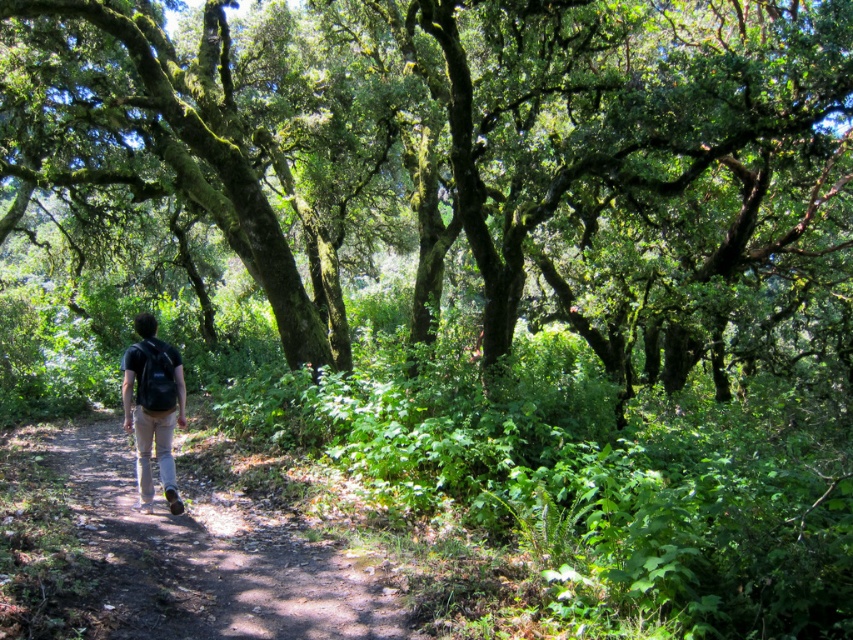
Based on the photo, you are standing at the point with coordinates point (131, 508) and want to walk towards the dense greenery ahead. There is another point at point (778, 145). Which direction should you move relative to the other point to reach the dense greenery?

You should move towards the direction of point (778, 145) because it is behind point (131, 508), meaning it is in the direction the person is walking towards the dense greenery.

You are the hiker in the scene. You want to take a photo of the green mossy tree at center without the matte black backpack at center appearing in the frame. How should you adjust your position?

The green mossy tree at center is located above the matte black backpack at center. To avoid the backpack in the photo, you can lower your camera angle or move slightly sideways so the backpack is no longer in the same vertical plane as the tree.

You are a hiker who wants to place a small marker on the closest object to you between the brown dirt path at center and the matte black backpack at center. Which object should you choose?

The brown dirt path at center is closer to the viewer than the matte black backpack at center, so you should place the marker on the brown dirt path at center.